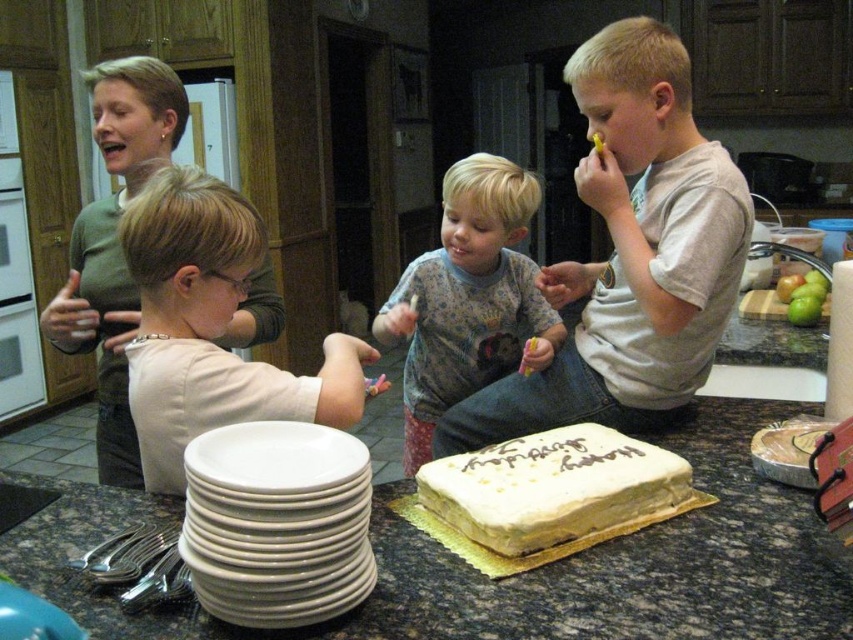
Question: Can you confirm if light gray t-shirt at center is thinner than white frosted cake at center?

Choices:
 (A) yes
 (B) no

Answer: (B)

Question: In this image, where is white ceramic plates at lower left located relative to gray cotton shirt at center?

Choices:
 (A) left
 (B) right

Answer: (A)

Question: Which of the following is the closest to the observer?

Choices:
 (A) light beige shirt at left
 (B) white ceramic plates at lower left

Answer: (B)

Question: Considering the real-world distances, which object is farthest from the white ceramic plates at lower left?

Choices:
 (A) light beige shirt at left
 (B) light gray t-shirt at center

Answer: (B)

Question: Does light gray t-shirt at center appear on the right side of white frosted cake at center?

Choices:
 (A) yes
 (B) no

Answer: (A)

Question: Which point is closer to the camera?

Choices:
 (A) light beige shirt at left
 (B) gray cotton shirt at center
 (C) white ceramic plates at lower left
 (D) white frosted cake at center

Answer: (C)